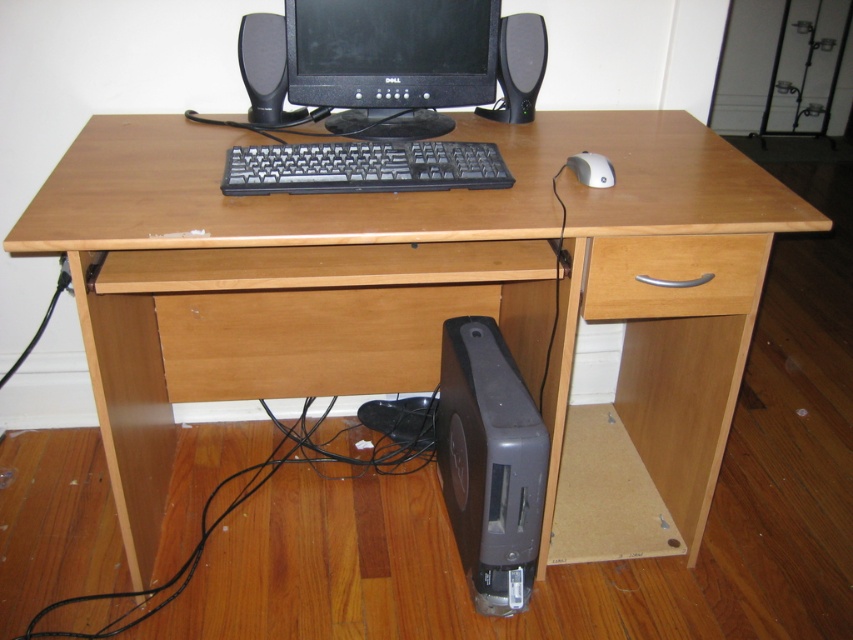
You are standing in front of the wooden desk setup in the home office. There is a point at coordinates point (326, 44). Can you estimate how far this point is from your current position?

The point (326, 44) is 4.85 feet away from the camera, so the distance is approximately 4.85 feet.

You are setting up a new wireless charger for your phone on the desk. The wooden drawer at lower center and the black plastic speaker at upper center are in the way. To place the charger between them, how far apart are these two objects?

The wooden drawer at lower center is 21.08 inches away from the black plastic speaker at upper center, so the distance between them is sufficient to place the wireless charger.